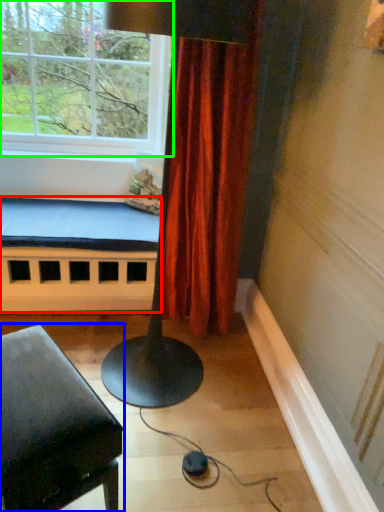
Question: Based on their relative distances, which object is farther from bed frame (highlighted by a red box)? Choose from furniture (highlighted by a blue box) and window (highlighted by a green box).

Choices:
 (A) furniture
 (B) window

Answer: (A)